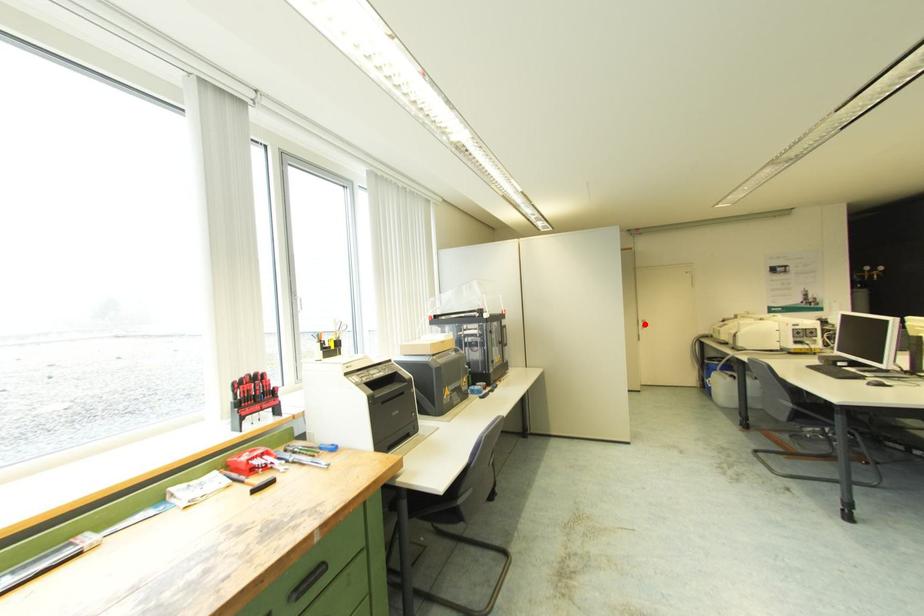
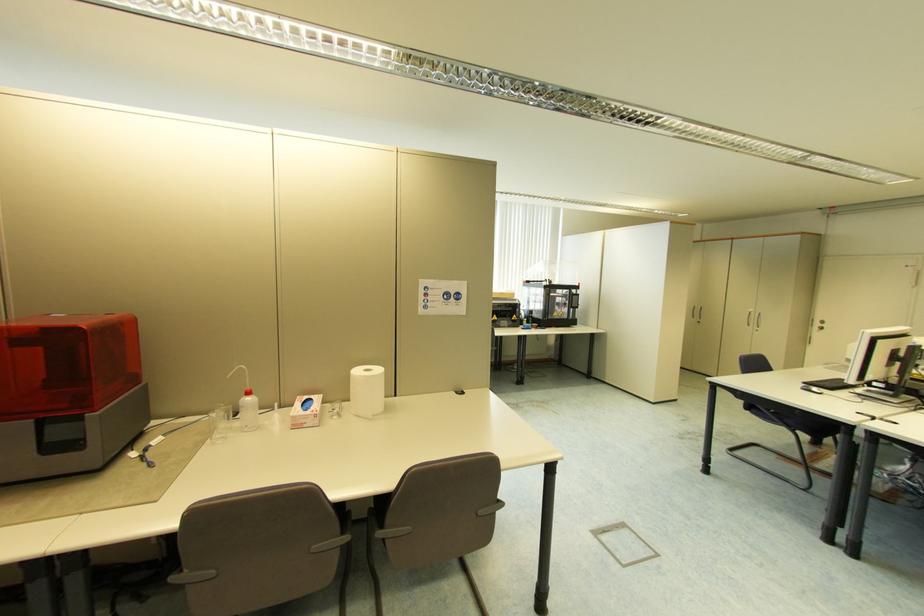
Question: A red point is marked in image1. In image2, is the corresponding 3D point closer to the camera or farther? Reply with the corresponding letter.

Choices:
 (A) The corresponding 3D point is closer.
 (B) The corresponding 3D point is farther.

Answer: (B)